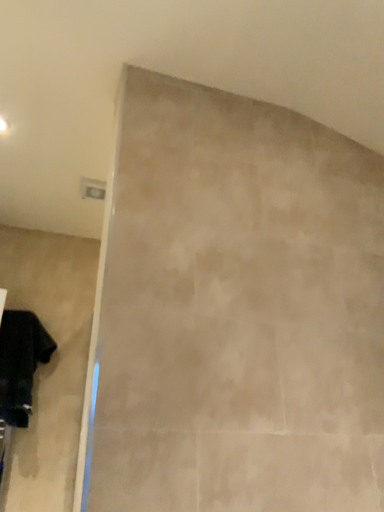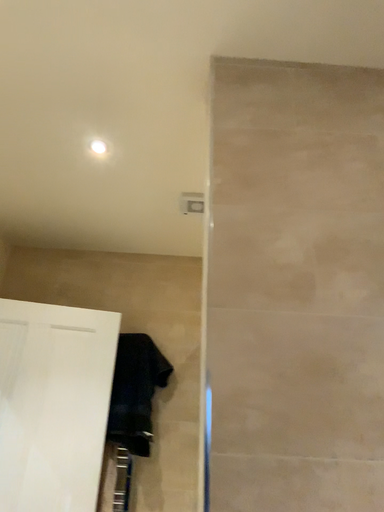
Question: How did the camera likely rotate when shooting the video?

Choices:
 (A) rotated left
 (B) rotated right

Answer: (A)